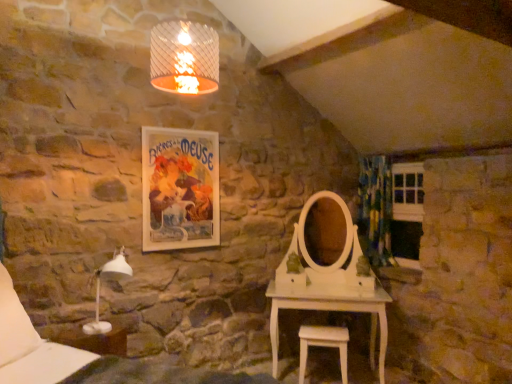
Question: Does white soft pillow at lower left have a lesser height compared to white wood stool at lower center?

Choices:
 (A) yes
 (B) no

Answer: (B)

Question: From a real-world perspective, is white soft pillow at lower left under white wood stool at lower center?

Choices:
 (A) no
 (B) yes

Answer: (A)

Question: Are white soft pillow at lower left and white wood stool at lower center located far from each other?

Choices:
 (A) yes
 (B) no

Answer: (A)

Question: Is white soft pillow at lower left smaller than white wood stool at lower center?

Choices:
 (A) no
 (B) yes

Answer: (A)

Question: Is white soft pillow at lower left outside white wood stool at lower center?

Choices:
 (A) no
 (B) yes

Answer: (B)

Question: From their relative heights in the image, would you say matte paper poster at upper center is taller or shorter than white soft pillow at lower left?

Choices:
 (A) tall
 (B) short

Answer: (A)

Question: From a real-world perspective, relative to white soft pillow at lower left, is matte paper poster at upper center vertically above or below?

Choices:
 (A) above
 (B) below

Answer: (A)

Question: Visually, is matte paper poster at upper center positioned to the left or to the right of white soft pillow at lower left?

Choices:
 (A) right
 (B) left

Answer: (A)

Question: In terms of size, does matte paper poster at upper center appear bigger or smaller than white soft pillow at lower left?

Choices:
 (A) big
 (B) small

Answer: (B)

Question: Is point (10, 294) closer or farther from the camera than point (377, 155)?

Choices:
 (A) farther
 (B) closer

Answer: (B)

Question: Is white soft pillow at lower left inside or outside of green floral fabric curtain at right?

Choices:
 (A) outside
 (B) inside

Answer: (A)

Question: From a real-world perspective, is white soft pillow at lower left positioned above or below green floral fabric curtain at right?

Choices:
 (A) above
 (B) below

Answer: (B)

Question: From the image's perspective, is white soft pillow at lower left positioned above or below green floral fabric curtain at right?

Choices:
 (A) below
 (B) above

Answer: (A)

Question: Is point (208, 180) positioned closer to the camera than point (97, 276)?

Choices:
 (A) farther
 (B) closer

Answer: (A)

Question: Is matte paper poster at upper center bigger or smaller than white plastic table lamp at lower left?

Choices:
 (A) small
 (B) big

Answer: (A)